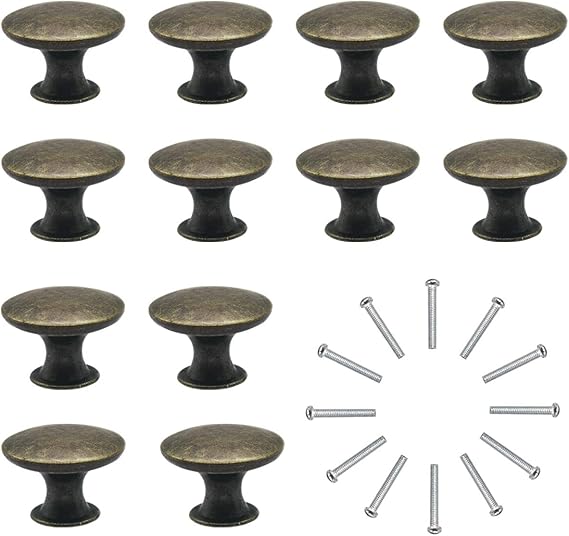
Image resolution: width=569 pixels, height=536 pixels. I want to click on silver screw, so click(527, 468).